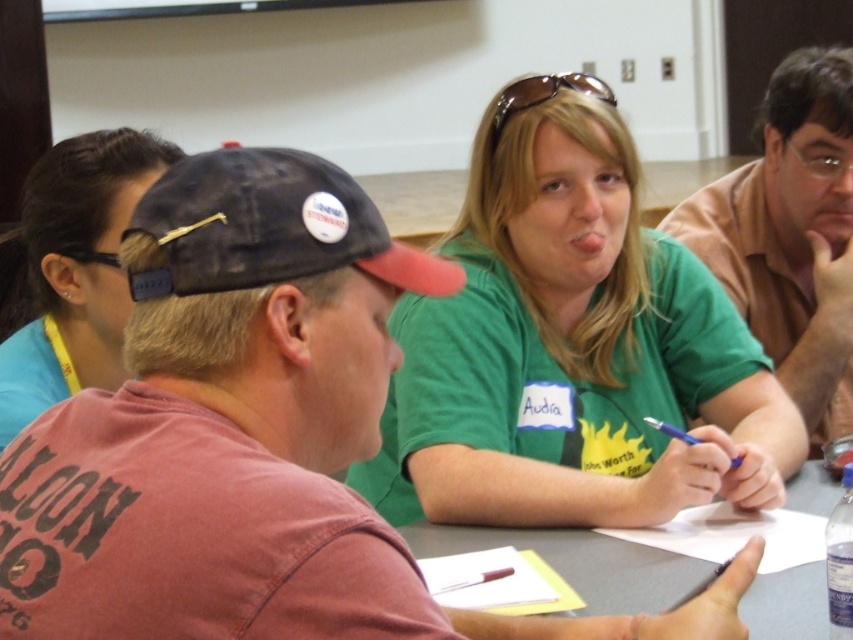
Is gray matte table at center thinner than blue plastic pen at center?

No.

Can you confirm if gray matte table at center is positioned to the right of blue plastic pen at center?

Incorrect, gray matte table at center is not on the right side of blue plastic pen at center.

Who is more forward, [782,592] or [659,419]?

Point [782,592] is more forward.

Find the location of a particular element. gray matte table at center is located at coordinates (581, 561).

Is dark blue fabric baseball cap at center-left thinner than blue plastic pen at center?

In fact, dark blue fabric baseball cap at center-left might be wider than blue plastic pen at center.

Which is in front, point (291, 257) or point (670, 429)?

Point (291, 257) is more forward.

Locate an element on the screen. dark blue fabric baseball cap at center-left is located at coordinates (270, 227).

Is point (523, 618) in front of point (813, 497)?

Yes, it is.

Between matte red cap at center and gray matte table at center, which one has more height?

matte red cap at center

Measure the distance between matte red cap at center and camera.

23.53 inches

Identify the location of matte red cap at center. (248, 435).